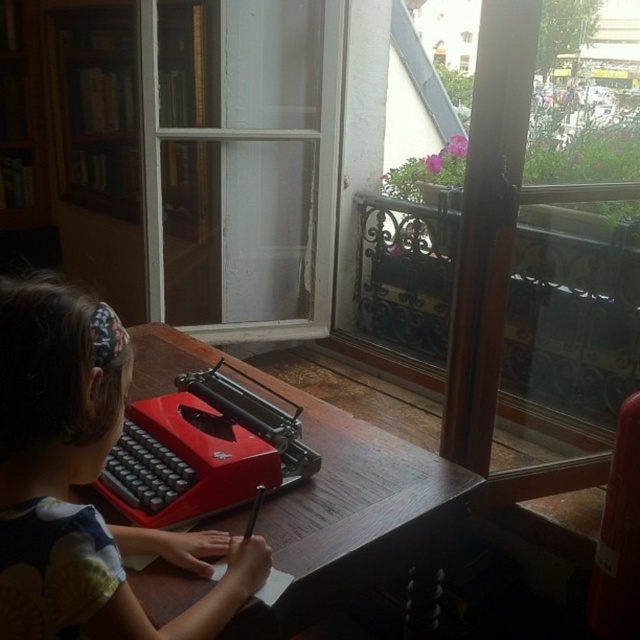
Question: Which point appears farthest from the camera in this image?

Choices:
 (A) (216, 525)
 (B) (291, 10)

Answer: (B)

Question: Which object is positioned farthest from the transparent glass door at upper center?

Choices:
 (A) wooden table at center
 (B) matte black hairband at upper left

Answer: (B)

Question: Can you confirm if transparent glass door at upper center is thinner than matte black hairband at upper left?

Choices:
 (A) no
 (B) yes

Answer: (A)

Question: Does matte black hairband at upper left appear on the left side of wooden table at center?

Choices:
 (A) no
 (B) yes

Answer: (B)

Question: Which object is the farthest from the matte black hairband at upper left?

Choices:
 (A) wooden table at center
 (B) transparent glass door at upper center

Answer: (B)

Question: Does matte black hairband at upper left appear on the right side of wooden table at center?

Choices:
 (A) yes
 (B) no

Answer: (B)